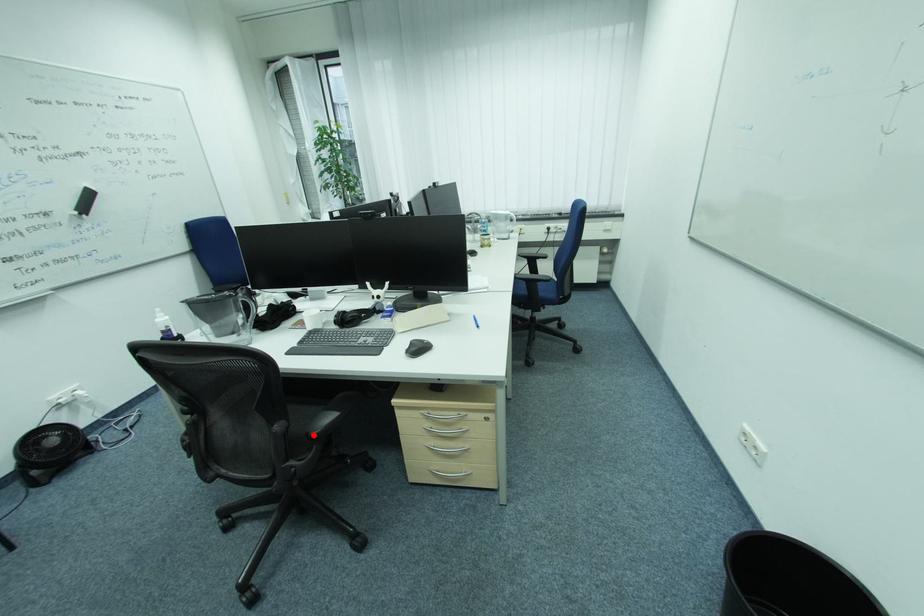
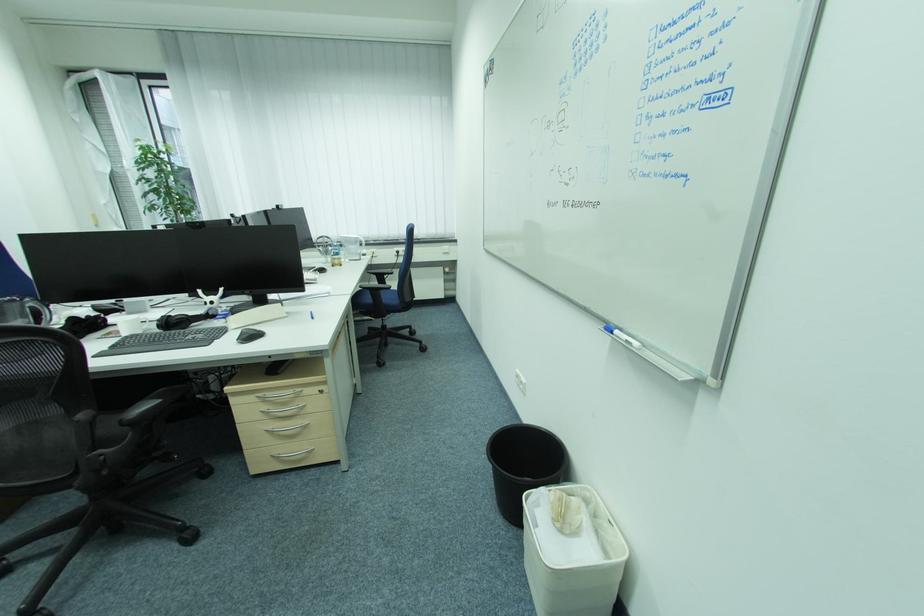
In the second image, find the point that corresponds to the highlighted location in the first image.

(128, 422)